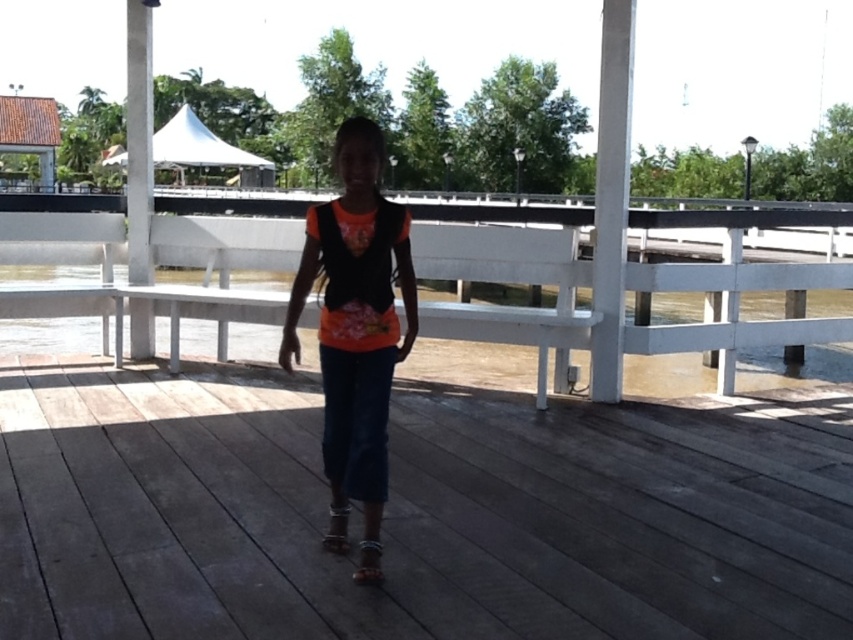
Is brown wooden deck at center shorter than orange matte shirt at center?

Indeed, brown wooden deck at center has a lesser height compared to orange matte shirt at center.

Which is behind, point (695, 605) or point (376, 545)?

Point (376, 545)

You are a GUI agent. You are given a task and a screenshot of the screen. Output one action in this format:
    pyautogui.click(x=<x>, y=<y>)
    Task: Click on the brown wooden deck at center
    
    Given the screenshot: What is the action you would take?
    pyautogui.click(x=416, y=513)

Locate an element on the screen. brown wooden deck at center is located at coordinates (416, 513).

Is brown wooden deck at center taller than white wooden porch at center?

No.

Which is more to the left, brown wooden deck at center or white wooden porch at center?

Positioned to the left is brown wooden deck at center.

Does point (786, 552) come in front of point (99, 211)?

Yes, it is.

At what (x,y) coordinates should I click in order to perform the action: click on brown wooden deck at center. Please return your answer as a coordinate pair (x, y). Image resolution: width=853 pixels, height=640 pixels. Looking at the image, I should click on (416, 513).

Between white wooden porch at center and orange matte shirt at center, which one has more height?

white wooden porch at center is taller.

Can you confirm if white wooden porch at center is positioned to the right of orange matte shirt at center?

Indeed, white wooden porch at center is positioned on the right side of orange matte shirt at center.

Describe the element at coordinates (508, 273) in the screenshot. I see `white wooden porch at center` at that location.

You are a GUI agent. You are given a task and a screenshot of the screen. Output one action in this format:
    pyautogui.click(x=<x>, y=<y>)
    Task: Click on the white wooden porch at center
    The width and height of the screenshot is (853, 640).
    Given the screenshot: What is the action you would take?
    pyautogui.click(x=508, y=273)